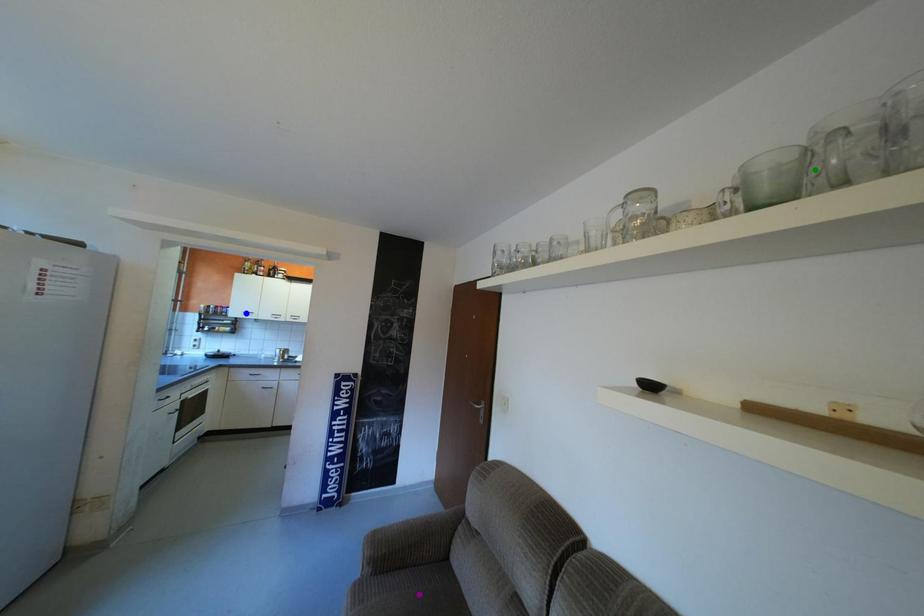
Order these from nearest to farthest:
- purple point
- blue point
- green point

green point
purple point
blue point